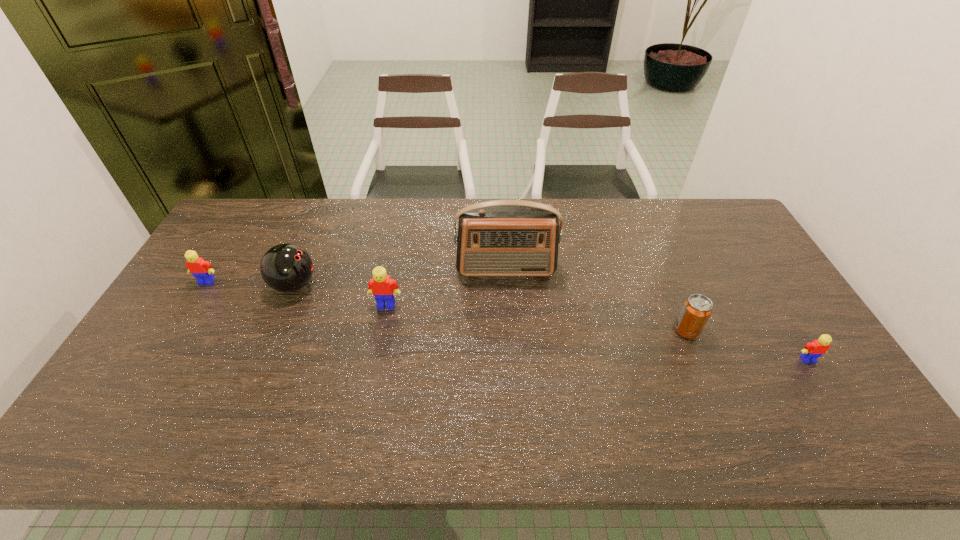
If equal spacing is the goal by inserting an additional Lego among them, please point out a vacant space for this new Lego. Please provide its 2D coordinates. Your answer should be formatted as a tuple, i.e. [(x, y)], where the tuple contains the x and y coordinates of a point satisfying the conditions above.

[(586, 331)]